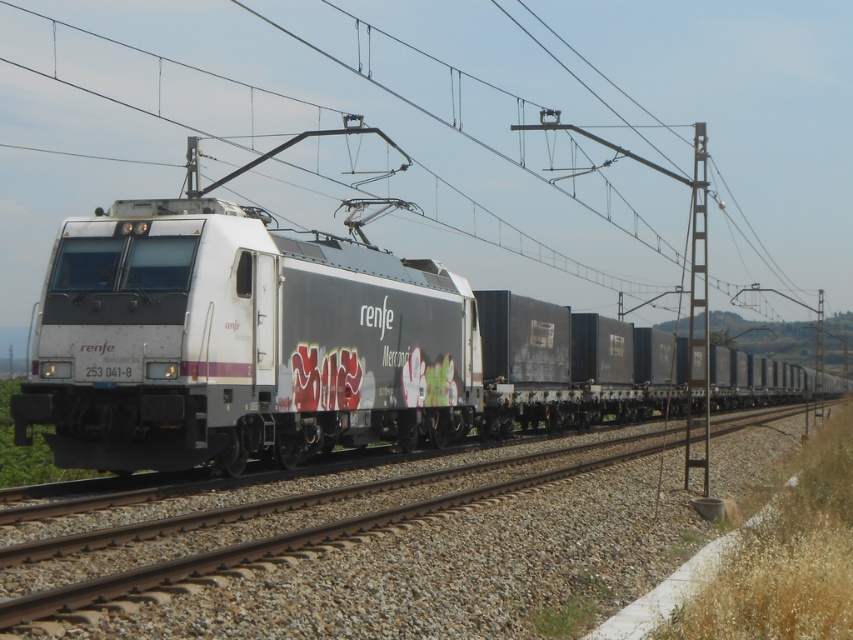
You are a maintenance worker inspecting the railway tracks. You notice the metallic wire at center and the metallic gray pole at right. Based on your knowledge of railway infrastructure, which object is positioned higher from the ground?

The metallic gray pole at right is positioned higher from the ground because the metallic wire at center is below it.

You are a passenger on the freight train and want to know if the point at coordinate (584,93) is closer to the front of the train compared to the point at coordinate (451,433). Can you determine this?

Point (584,93) is behind point (451,433), so it is not closer to the front of the train.